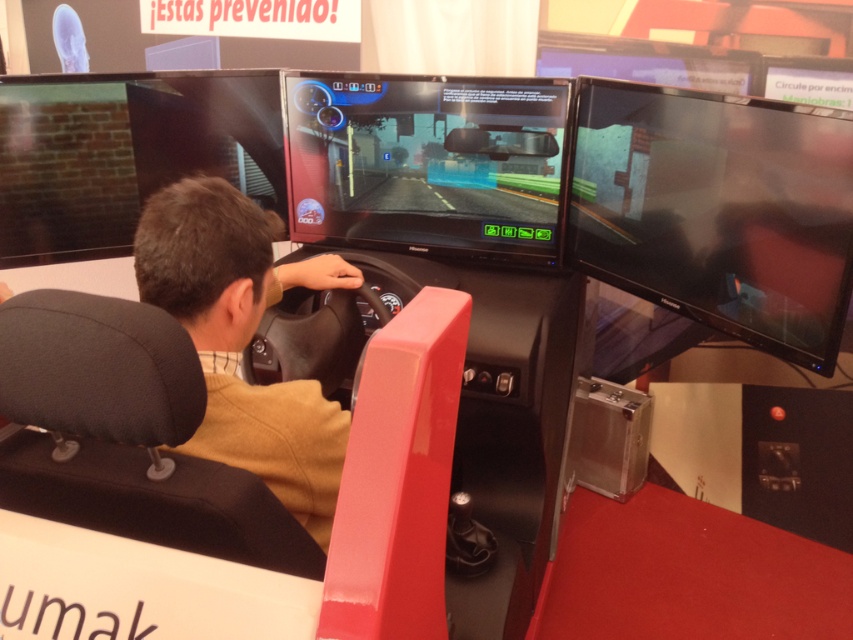
Question: Which object appears closest to the camera in this image?

Choices:
 (A) brown leather jacket at center
 (B) matte black monitor at upper center
 (C) matte black monitor at right

Answer: (A)

Question: In this image, where is matte black monitor at right located relative to matte black monitor at upper center?

Choices:
 (A) left
 (B) right

Answer: (A)

Question: Does matte black monitor at right have a larger size compared to matte black monitor at left?

Choices:
 (A) no
 (B) yes

Answer: (B)

Question: Which point appears farthest from the camera in this image?

Choices:
 (A) (717, 284)
 (B) (99, 112)

Answer: (B)

Question: In this image, where is matte black monitor at center located relative to brown leather jacket at center?

Choices:
 (A) right
 (B) left

Answer: (A)

Question: Which of these objects is positioned closest to the matte black monitor at center?

Choices:
 (A) brown leather jacket at center
 (B) matte black monitor at upper center

Answer: (B)